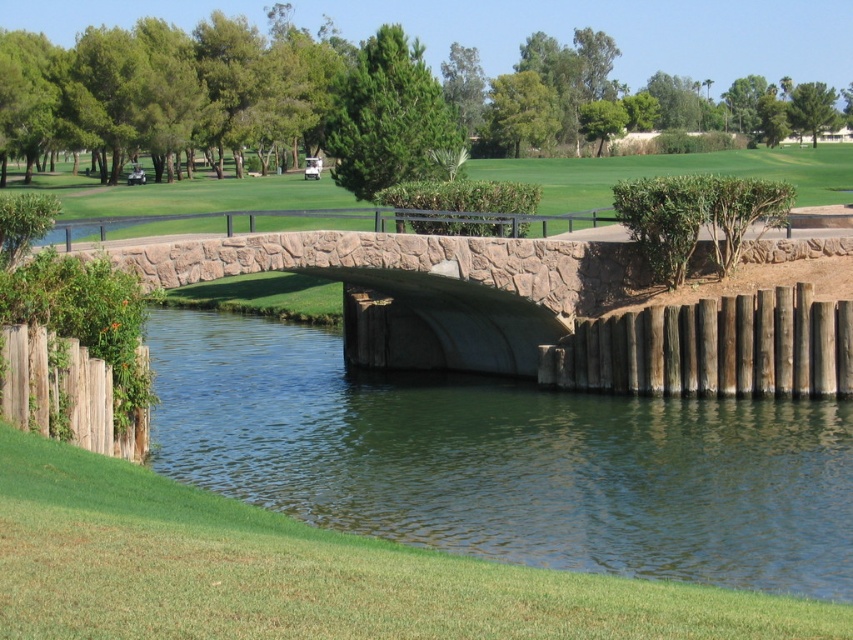
Does stone bridge at center have a larger size compared to smooth stone bridge at center?

No.

Who is taller, stone bridge at center or smooth stone bridge at center?

With more height is smooth stone bridge at center.

The height and width of the screenshot is (640, 853). Identify the location of stone bridge at center. (529, 310).

Is green concrete river at center above smooth stone bridge at center?

No, green concrete river at center is not above smooth stone bridge at center.

Does point (289, 365) come farther from viewer compared to point (691, 168)?

No, it is in front of (691, 168).

You are a GUI agent. You are given a task and a screenshot of the screen. Output one action in this format:
    pyautogui.click(x=<x>, y=<y>)
    Task: Click on the green concrete river at center
    
    Given the screenshot: What is the action you would take?
    point(508,460)

Is green concrete river at center behind stone bridge at center?

No, green concrete river at center is closer to the viewer.

Is green concrete river at center above stone bridge at center?

No, green concrete river at center is not above stone bridge at center.

Where is `green concrete river at center`? Image resolution: width=853 pixels, height=640 pixels. green concrete river at center is located at coordinates (508, 460).

You are a GUI agent. You are given a task and a screenshot of the screen. Output one action in this format:
    pyautogui.click(x=<x>, y=<y>)
    Task: Click on the green concrete river at center
    This screenshot has height=640, width=853.
    Given the screenshot: What is the action you would take?
    pyautogui.click(x=508, y=460)